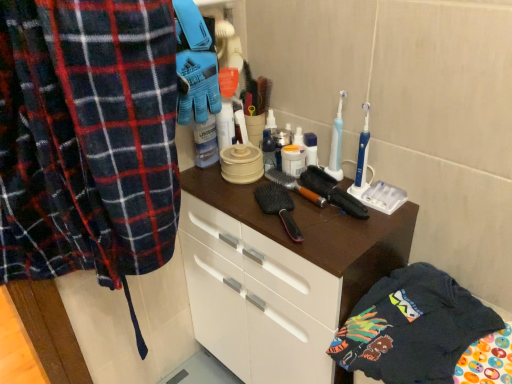
You are a GUI agent. You are given a task and a screenshot of the screen. Output one action in this format:
    pyautogui.click(x=<x>, y=<y>)
    Task: Click on the free region on the left part of brown wooden brush at center, the 2th brush from the right
    The height and width of the screenshot is (384, 512).
    Given the screenshot: What is the action you would take?
    pyautogui.click(x=224, y=193)